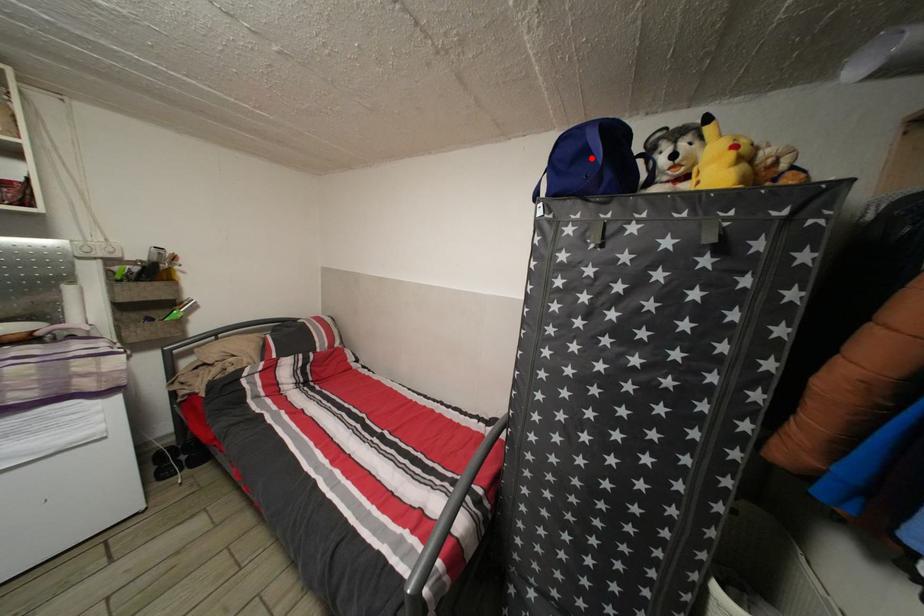
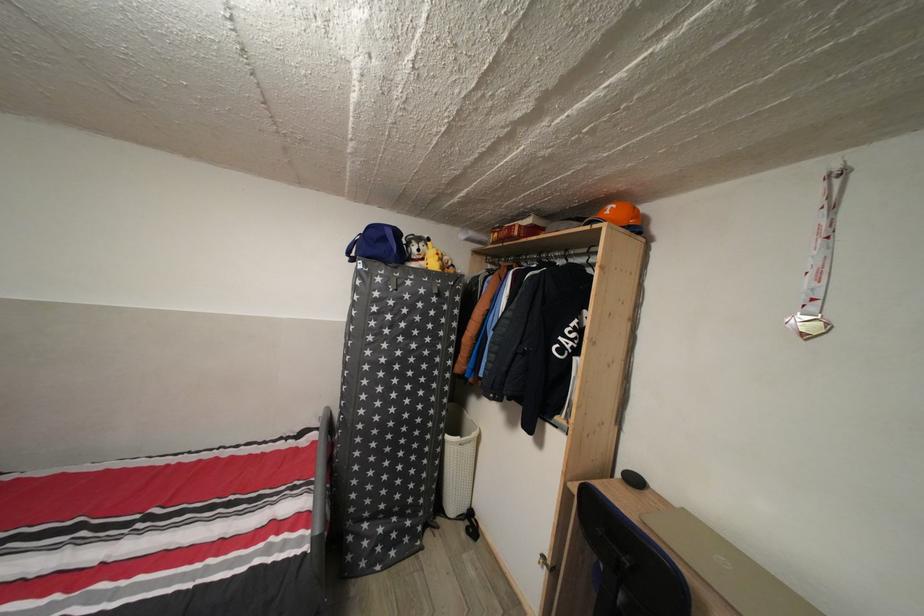
The point at the highlighted location is marked in the first image. Where is the corresponding point in the second image?

(391, 246)